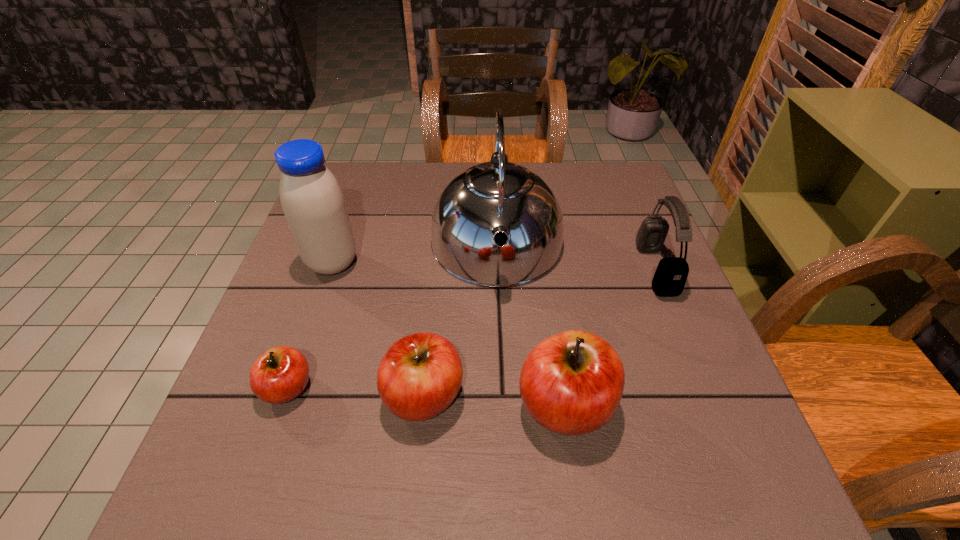
The image size is (960, 540). What are the coordinates of `the shortest object` in the screenshot? It's located at pyautogui.click(x=281, y=374).

At what (x,y) coordinates should I click in order to perform the action: click on the leftmost apple. Please return your answer as a coordinate pair (x, y). Looking at the image, I should click on (281, 374).

Where is `the second tallest apple`? The image size is (960, 540). the second tallest apple is located at coordinates (419, 376).

Locate an element on the screen. the second shortest object is located at coordinates (419, 376).

Identify the location of the rightmost apple. (571, 383).

This screenshot has height=540, width=960. What are the coordinates of `kettle` in the screenshot? It's located at (497, 196).

This screenshot has width=960, height=540. What are the coordinates of `headset` in the screenshot? It's located at (671, 274).

Image resolution: width=960 pixels, height=540 pixels. Find the location of `soya milk`. soya milk is located at coordinates (312, 201).

I want to click on vacant point located 0.230m on the back of the shortest apple, so click(x=324, y=280).

The height and width of the screenshot is (540, 960). What are the coordinates of `vacant area situated 0.230m on the right of the second apple from left to right` in the screenshot? It's located at (590, 396).